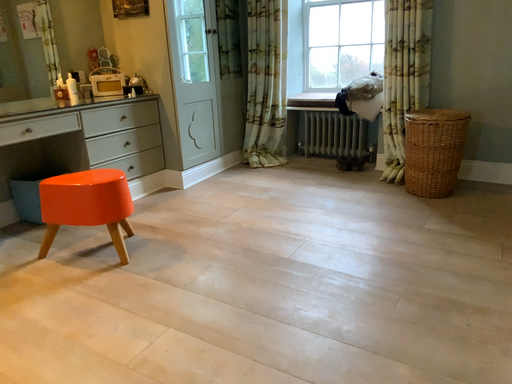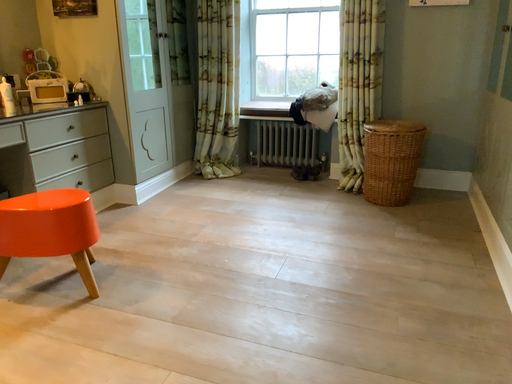
Question: How did the camera likely rotate when shooting the video?

Choices:
 (A) rotated left
 (B) rotated right

Answer: (B)